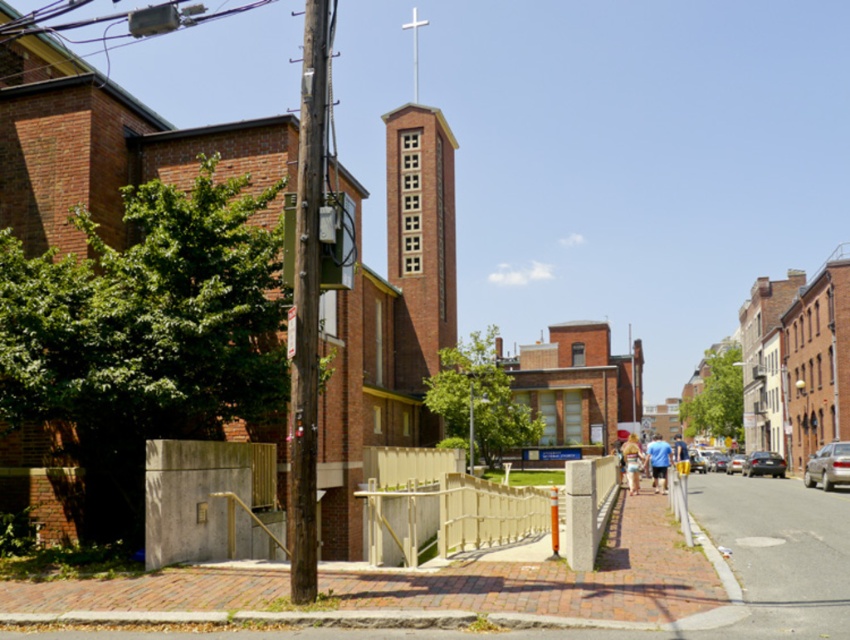
Question: Which is nearer to the silver metallic sedan at center?

Choices:
 (A) silver metallic sedan at right
 (B) blue cotton shirt at center-right
 (C) smooth asphalt road at lower right

Answer: (A)

Question: Is smooth asphalt road at lower right bigger than shiny silver sedan at center-right?

Choices:
 (A) no
 (B) yes

Answer: (B)

Question: Which object is the closest to the blue cotton shirt at center-right?

Choices:
 (A) shiny silver sedan at center-right
 (B) silver metallic sedan at right

Answer: (B)

Question: Is silver metallic sedan at center-right above metallic silver sedan at center-right?

Choices:
 (A) no
 (B) yes

Answer: (B)

Question: Which object appears closest to the camera in this image?

Choices:
 (A) silver metallic sedan at center
 (B) shiny silver sedan at center-right
 (C) yellow fabric dress at center

Answer: (C)

Question: Is yellow fabric dress at center to the left of metallic silver sedan at center-right from the viewer's perspective?

Choices:
 (A) yes
 (B) no

Answer: (A)